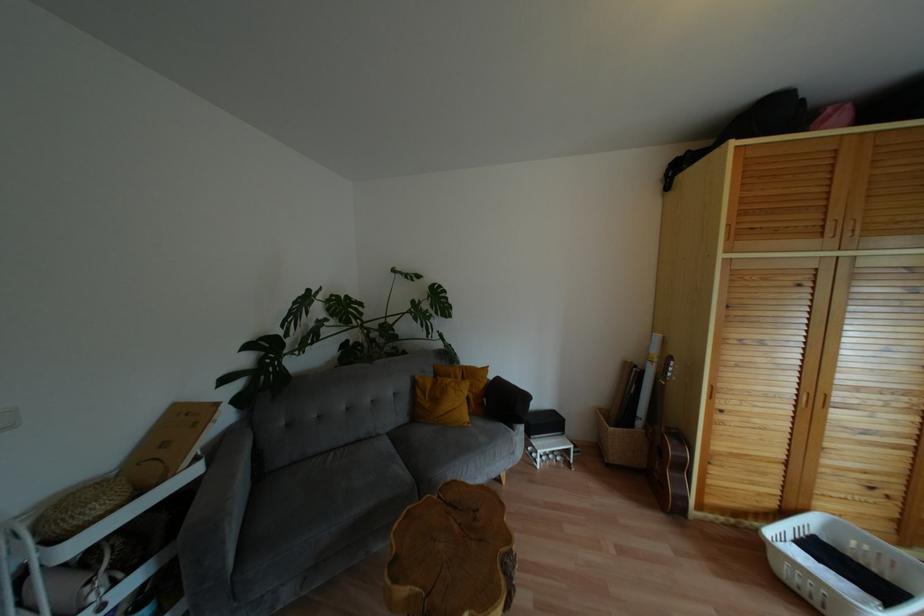
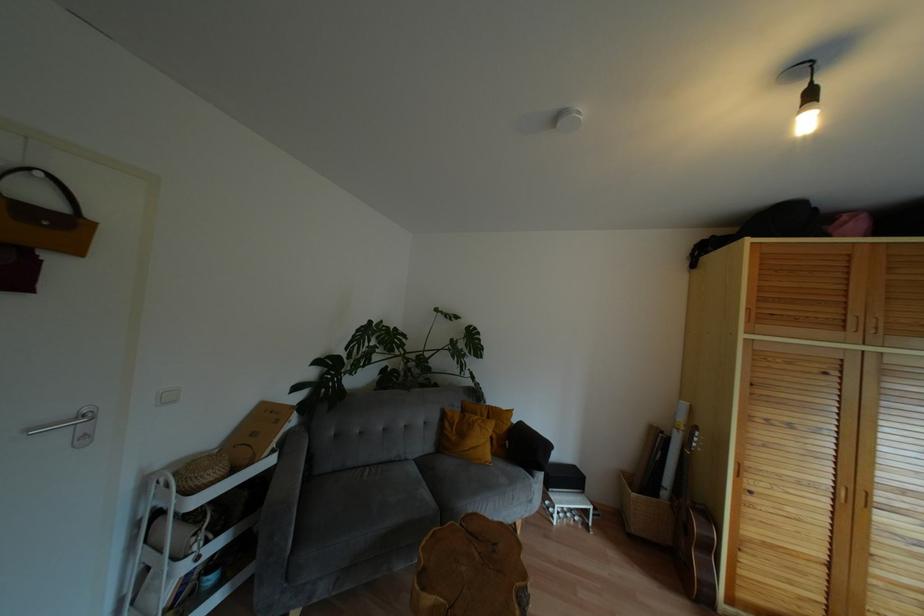
Locate, in the second image, the point that corresponds to the point at 847,227 in the first image.

(870, 323)